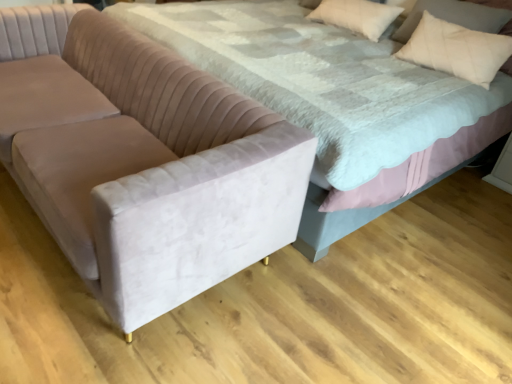
Question: From the image's perspective, is white soft pillow at upper right beneath velvet bed at center?

Choices:
 (A) no
 (B) yes

Answer: (A)

Question: Is velvet bed at center a part of white soft pillow at upper right?

Choices:
 (A) no
 (B) yes

Answer: (A)

Question: Considering the relative sizes of white soft pillow at upper right and velvet bed at center in the image provided, is white soft pillow at upper right thinner than velvet bed at center?

Choices:
 (A) no
 (B) yes

Answer: (B)

Question: Can you confirm if white soft pillow at upper right is taller than velvet bed at center?

Choices:
 (A) no
 (B) yes

Answer: (A)

Question: Can you confirm if white soft pillow at upper right is shorter than velvet bed at center?

Choices:
 (A) yes
 (B) no

Answer: (A)

Question: Considering the relative sizes of white soft pillow at upper right and velvet bed at center in the image provided, is white soft pillow at upper right bigger than velvet bed at center?

Choices:
 (A) yes
 (B) no

Answer: (B)

Question: Does white soft pillow at upper right have a greater height compared to beige cotton pillow at upper right?

Choices:
 (A) no
 (B) yes

Answer: (A)

Question: From the image's perspective, is white soft pillow at upper right below beige cotton pillow at upper right?

Choices:
 (A) yes
 (B) no

Answer: (B)

Question: Considering the relative sizes of white soft pillow at upper right and beige cotton pillow at upper right in the image provided, is white soft pillow at upper right shorter than beige cotton pillow at upper right?

Choices:
 (A) yes
 (B) no

Answer: (A)

Question: From a real-world perspective, does white soft pillow at upper right sit lower than beige cotton pillow at upper right?

Choices:
 (A) no
 (B) yes

Answer: (B)

Question: From the image's perspective, is white soft pillow at upper right over beige cotton pillow at upper right?

Choices:
 (A) yes
 (B) no

Answer: (A)

Question: Can you confirm if white soft pillow at upper right is positioned to the right of beige cotton pillow at upper right?

Choices:
 (A) yes
 (B) no

Answer: (B)

Question: Would you say beige cotton pillow at upper right is outside velvet couch at left?

Choices:
 (A) yes
 (B) no

Answer: (A)